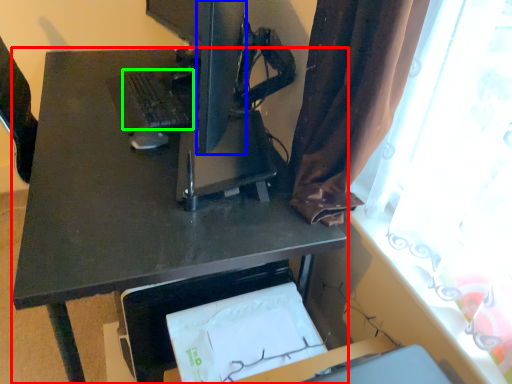
Question: Which object is positioned closest to desk (highlighted by a red box)? Select from computer monitor (highlighted by a blue box) and laptop keyboard (highlighted by a green box).

Choices:
 (A) computer monitor
 (B) laptop keyboard

Answer: (B)